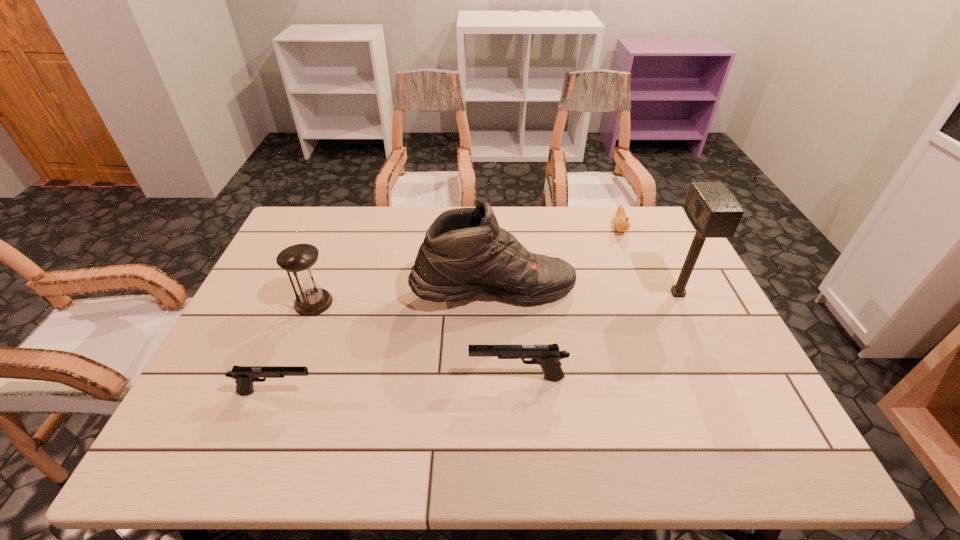
Where is `hourglass at the left edge`? This screenshot has width=960, height=540. hourglass at the left edge is located at coordinates (311, 300).

Locate an element on the screen. The image size is (960, 540). banana that is at the right edge is located at coordinates (621, 220).

Locate an element on the screen. The image size is (960, 540). mallet situated at the right edge is located at coordinates (713, 211).

The image size is (960, 540). I want to click on object that is at the near left corner, so click(244, 376).

Locate an element on the screen. This screenshot has width=960, height=540. object situated at the far right corner is located at coordinates (621, 220).

Find the location of a particular element. Image resolution: width=960 pixels, height=540 pixels. free space at the far edge of the desktop is located at coordinates (365, 236).

Where is `vacant position at the near edge of the desktop`? This screenshot has height=540, width=960. vacant position at the near edge of the desktop is located at coordinates (548, 417).

I want to click on vacant space at the left edge, so click(x=278, y=338).

This screenshot has width=960, height=540. I want to click on vacant region at the far left corner of the desktop, so [292, 230].

In the image, there is a desktop. Identify the location of free space at the far right corner. This screenshot has width=960, height=540. (634, 208).